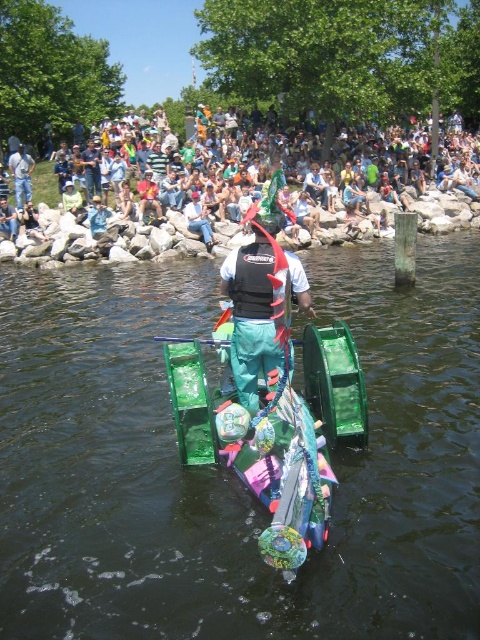
Between shiny green plastic boat at center and light blue fabric shirt at center, which one appears on the left side from the viewer's perspective?

light blue fabric shirt at center is more to the left.

Which of these two, shiny green plastic boat at center or light blue fabric shirt at center, stands shorter?

Standing shorter between the two is light blue fabric shirt at center.

Who is more distant from viewer, (257, 484) or (27, 225)?

The point (27, 225) is more distant.

This screenshot has width=480, height=640. What are the coordinates of `shiny green plastic boat at center` in the screenshot? It's located at (288, 481).

Does multicolored fabric crowd at upper center appear under light blue fabric shirt at center?

Incorrect, multicolored fabric crowd at upper center is not positioned below light blue fabric shirt at center.

Does point (319, 211) lie behind point (25, 209)?

No, it is not.

Image resolution: width=480 pixels, height=640 pixels. In order to click on multicolored fabric crowd at upper center in this screenshot , I will do tap(240, 186).

Is point (327, 216) farther from viewer compared to point (247, 353)?

Yes.

I want to click on multicolored fabric crowd at upper center, so click(x=240, y=186).